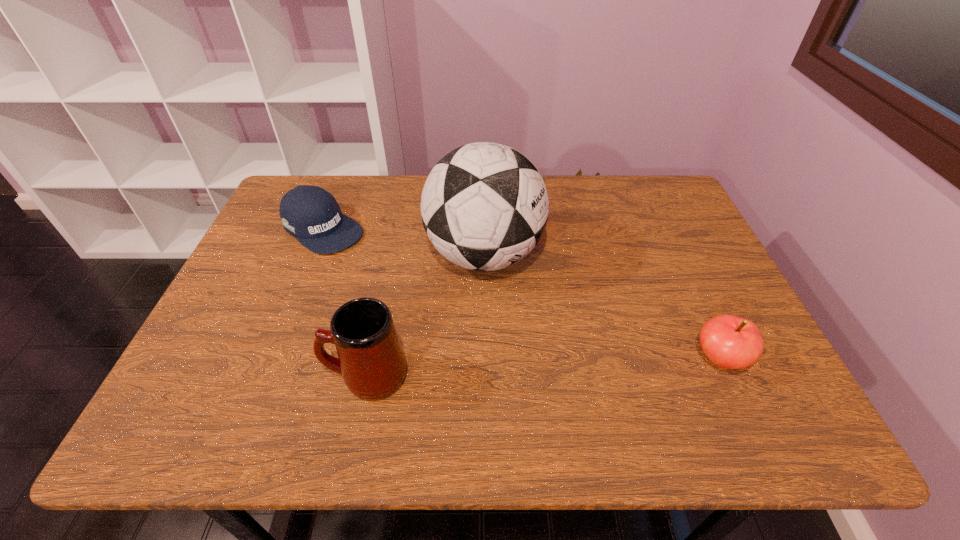
Locate an element on the screen. apple present at the near edge is located at coordinates (731, 342).

Find the location of a particular element. object present at the left edge is located at coordinates (311, 214).

This screenshot has width=960, height=540. What are the coordinates of `object positioned at the right edge` in the screenshot? It's located at (731, 342).

Find the location of a particular element. object at the far left corner is located at coordinates (311, 214).

This screenshot has height=540, width=960. What are the coordinates of `object present at the near right corner` in the screenshot? It's located at (731, 342).

The height and width of the screenshot is (540, 960). What are the coordinates of `vacant space at the far edge of the desktop` in the screenshot? It's located at (357, 188).

Find the location of a particular element. free region at the near edge is located at coordinates click(x=467, y=378).

This screenshot has width=960, height=540. In order to click on vacant space at the left edge in this screenshot , I will do `click(275, 295)`.

Locate an element on the screen. Image resolution: width=960 pixels, height=540 pixels. vacant space at the right edge of the desktop is located at coordinates (708, 275).

Where is `unoccupied position between the tallest object and the rightmost object`? unoccupied position between the tallest object and the rightmost object is located at coordinates (602, 307).